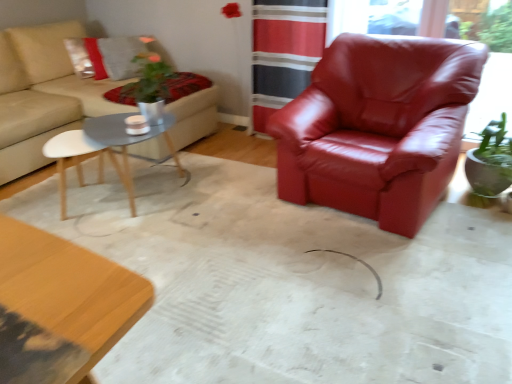
I want to click on vacant position to the left of satin red armchair at center, so click(x=229, y=202).